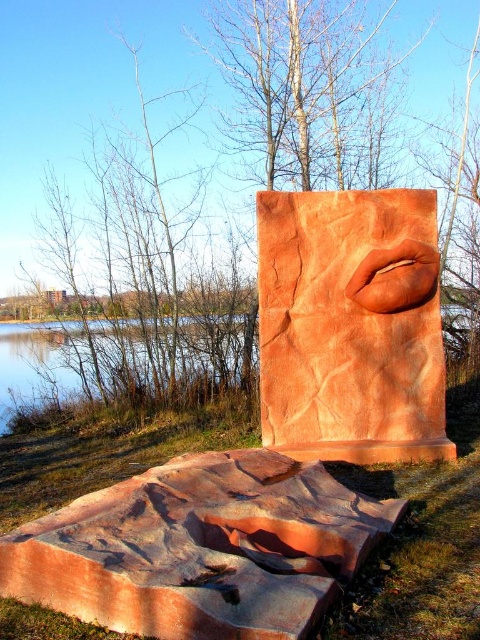
Is brown wood tree at center in front of clear water at lower left?

No, it is behind clear water at lower left.

Looking at this image, is brown wood tree at center shorter than clear water at lower left?

Incorrect, brown wood tree at center's height does not fall short of clear water at lower left's.

Between point (49, 22) and point (59, 362), which one is positioned in front?

Point (59, 362) is more forward.

Identify the location of brown wood tree at center. The width and height of the screenshot is (480, 640). (103, 108).

Which is above, brown wood tree at center or matte clay lips at center?

Positioned higher is brown wood tree at center.

This screenshot has width=480, height=640. What do you see at coordinates (103, 108) in the screenshot? I see `brown wood tree at center` at bounding box center [103, 108].

Is point (84, 150) more distant than point (434, 291)?

Yes, point (84, 150) is behind point (434, 291).

The height and width of the screenshot is (640, 480). Identify the location of brown wood tree at center. (103, 108).

Does matte clay lips at center have a larger size compared to clear water at lower left?

No.

Can you confirm if matte clay lips at center is positioned above clear water at lower left?

Indeed, matte clay lips at center is positioned over clear water at lower left.

This screenshot has height=640, width=480. I want to click on matte clay lips at center, so click(x=350, y=324).